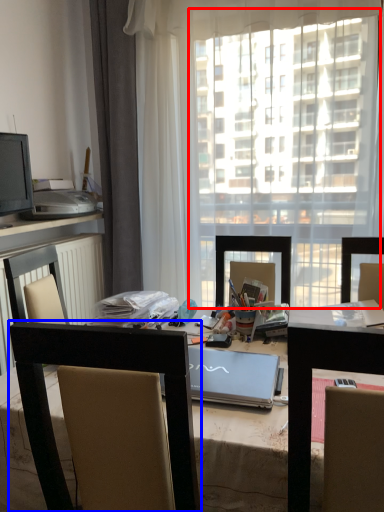
Question: Which object is closer to the camera taking this photo, window screen (highlighted by a red box) or chair (highlighted by a blue box)?

Choices:
 (A) window screen
 (B) chair

Answer: (B)